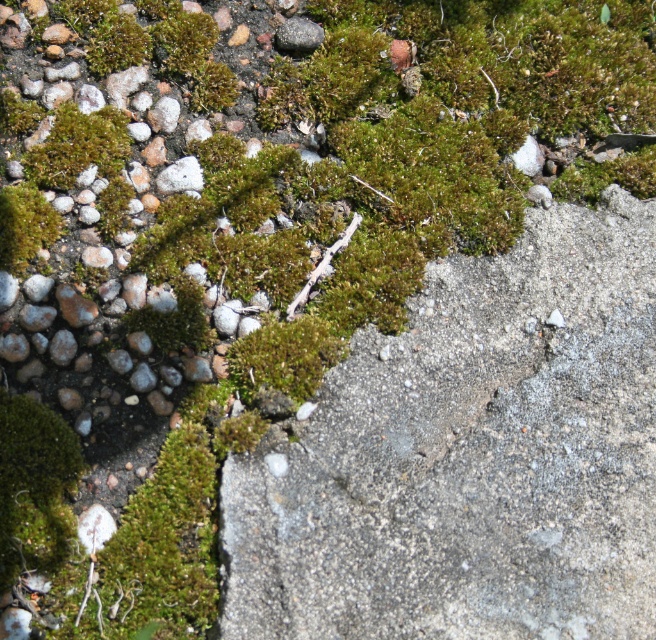
You are a gardener planning to plant a new shrub. You have two options for placement based on the image. The first option is near the gray concrete at center, and the second option is near the green mossy patch at upper left. Which location would you choose for better plant growth, and why?

The green mossy patch at upper left is a better choice for plant growth because it is located above the gray concrete at center. Moss typically thrives in moist, nutrient rich environments, which suggests the area has better soil conditions for the shrub to grow healthily.

You are standing at the point labeled point (615,349) and want to walk towards the point labeled point (51,129). Given that the ground between them has a concrete surface, will you be walking uphill or downhill?

Since point (615,349) is closer to the viewer than point (51,129), you would be walking downhill towards the point (51,129) as you move away from the viewer.

You are a gardener planning to plant a new moss garden. You observe the gray concrete at center and the green mossy patch at upper left in the scene. Which object is positioned to the right of the other?

The gray concrete at center is to the right of the green mossy patch at upper left.